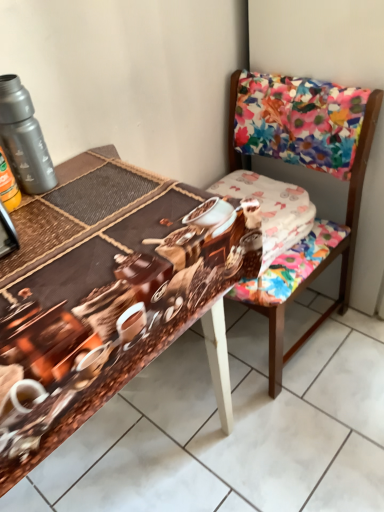
Question: In terms of size, does floral fabric chair at upper right appear bigger or smaller than white cotton fabric at center?

Choices:
 (A) big
 (B) small

Answer: (A)

Question: Relative to white cotton fabric at center, is floral fabric chair at upper right in front or behind?

Choices:
 (A) behind
 (B) front

Answer: (B)

Question: Considering the real-world distances, which object is closest to the floral fabric chair at upper right?

Choices:
 (A) brown printed fabric at center
 (B) white cotton fabric at center
 (C) metallic gray thermos at upper left

Answer: (B)

Question: Which object is positioned farthest from the metallic gray thermos at upper left?

Choices:
 (A) white cotton fabric at center
 (B) floral fabric chair at upper right
 (C) brown printed fabric at center

Answer: (B)